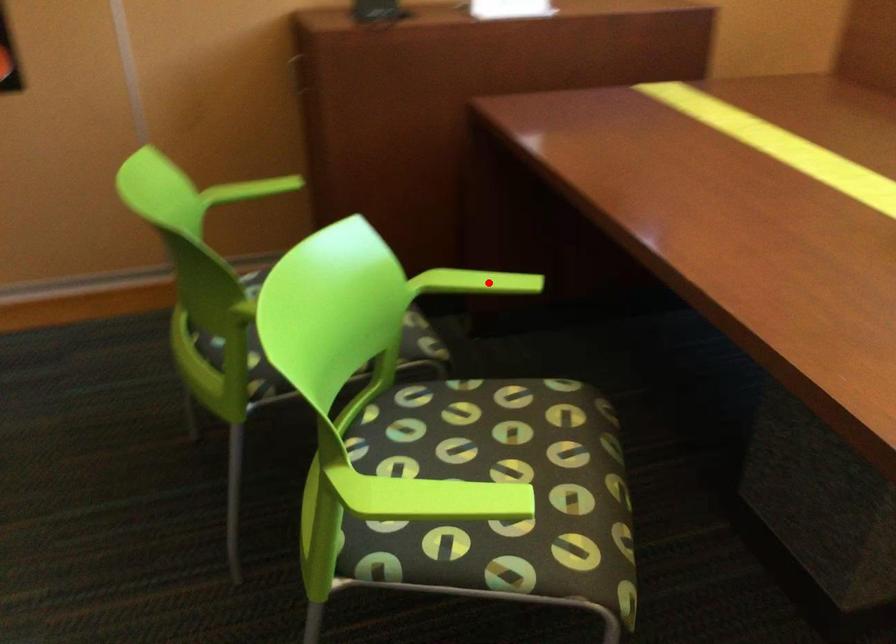
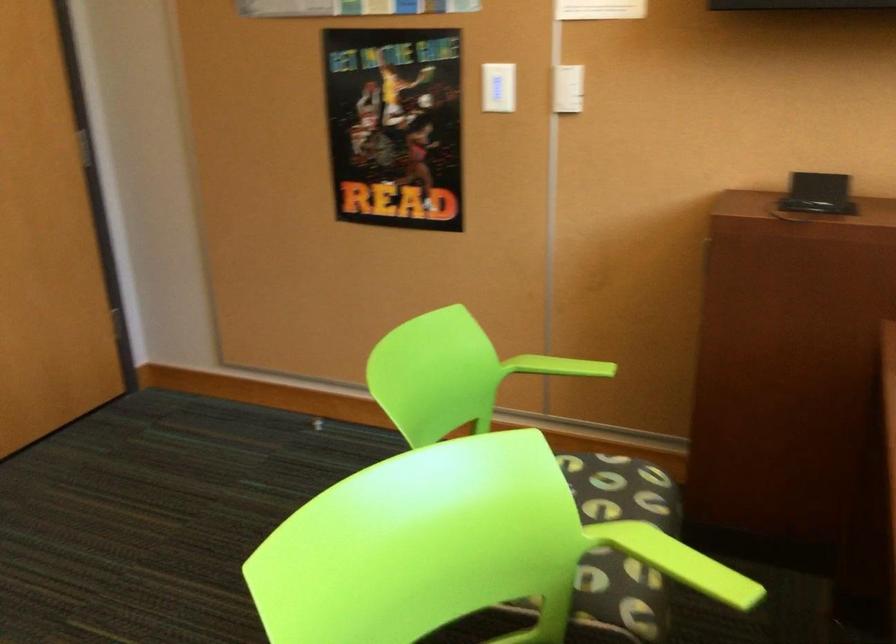
Locate, in the second image, the point that corresponds to the highlighted location in the first image.

(685, 564)